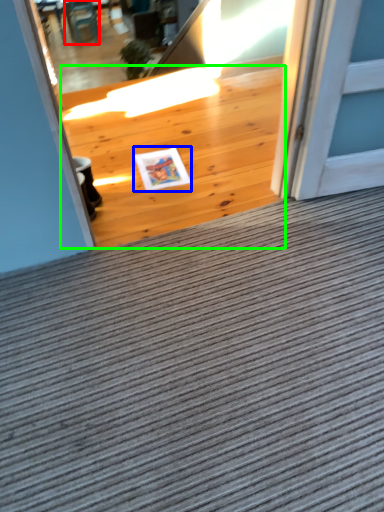
Question: Based on their relative distances, which object is farther from chair (highlighted by a red box)? Choose from postcard (highlighted by a blue box) and hardwood (highlighted by a green box).

Choices:
 (A) postcard
 (B) hardwood

Answer: (A)